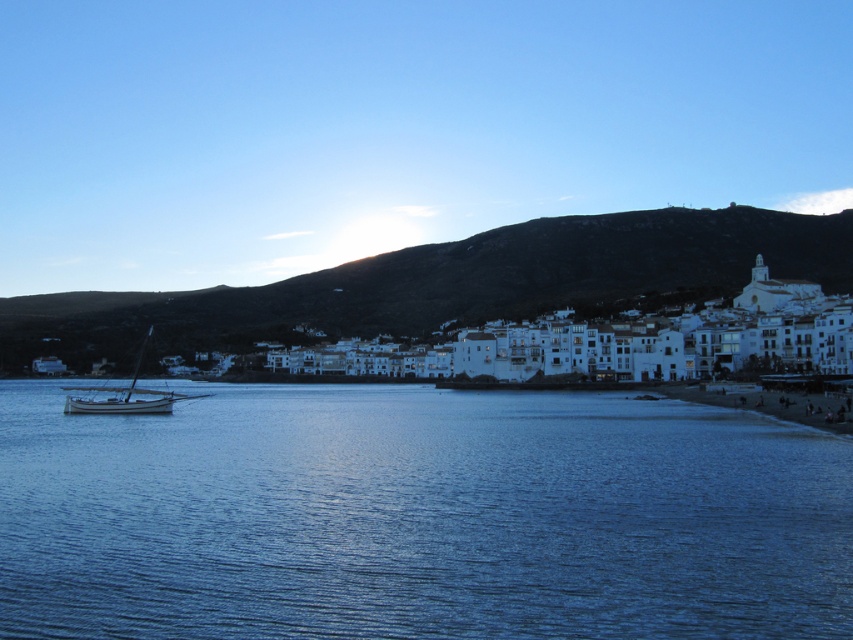
Question: Estimate the real-world distances between objects in this image. Which object is closer to the dark green hillside at upper center?

Choices:
 (A) wooden sailboat at left
 (B) blue water at center

Answer: (A)

Question: Estimate the real-world distances between objects in this image. Which object is closer to the wooden sailboat at left?

Choices:
 (A) blue water at center
 (B) dark green hillside at upper center

Answer: (A)

Question: Where is blue water at center located in relation to wooden sailboat at left in the image?

Choices:
 (A) left
 (B) right

Answer: (B)

Question: Can you confirm if dark green hillside at upper center is thinner than wooden sailboat at left?

Choices:
 (A) yes
 (B) no

Answer: (B)

Question: Does blue water at center have a greater width compared to wooden sailboat at left?

Choices:
 (A) yes
 (B) no

Answer: (A)

Question: Estimate the real-world distances between objects in this image. Which object is closer to the dark green hillside at upper center?

Choices:
 (A) wooden sailboat at left
 (B) blue water at center

Answer: (A)